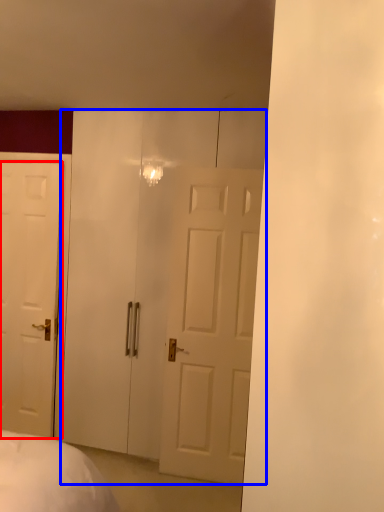
Question: Among these objects, which one is nearest to the camera, door (highlighted by a red box) or glass door (highlighted by a blue box)?

Choices:
 (A) door
 (B) glass door

Answer: (B)